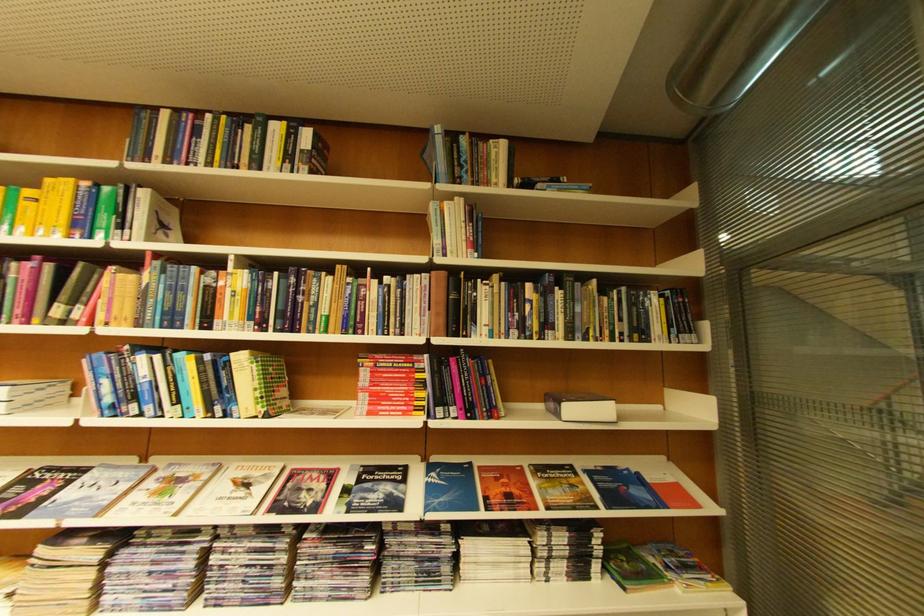
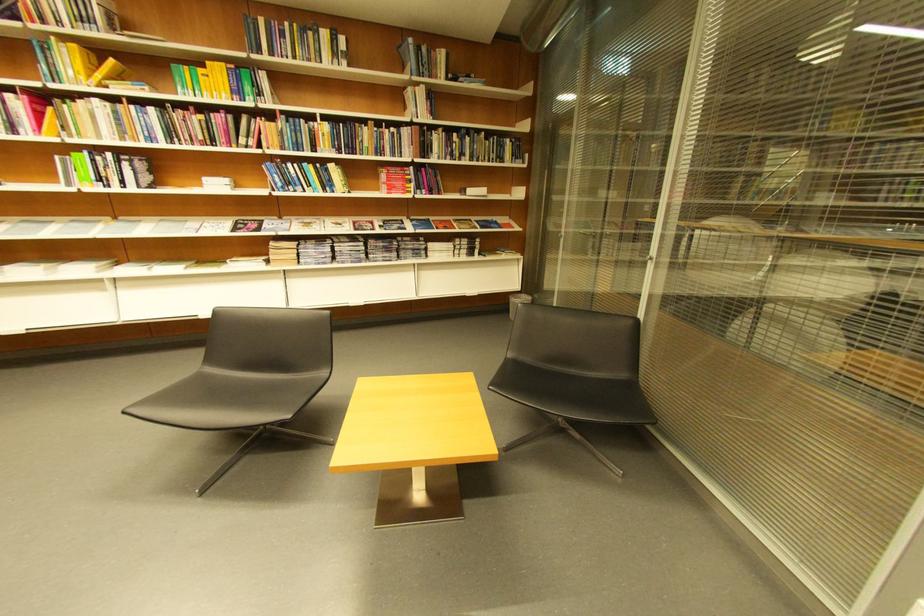
In the second image, find the point that corresponds to pixel 82 182 in the first image.

(234, 66)